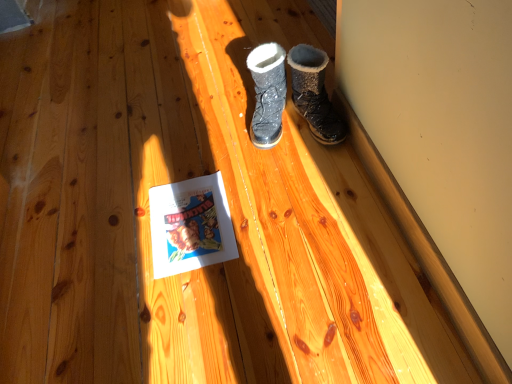
Question: From a real-world perspective, is dark brown suede boot at upper right, which appears as the first footwear when viewed from the right, physically located above or below white paper at center?

Choices:
 (A) above
 (B) below

Answer: (A)

Question: Is dark brown suede boot at upper right, which appears as the first footwear when viewed from the right, in front of or behind white paper at center in the image?

Choices:
 (A) behind
 (B) front

Answer: (A)

Question: Which object is the closest to the white paper at center?

Choices:
 (A) sparkly black boot at center, which is the second footwear in right-to-left order
 (B) dark brown suede boot at upper right, which appears as the first footwear when viewed from the right

Answer: (A)

Question: Considering the real-world distances, which object is farthest from the sparkly black boot at center, the first footwear from the left?

Choices:
 (A) white paper at center
 (B) dark brown suede boot at upper right, which appears as the first footwear when viewed from the right

Answer: (A)